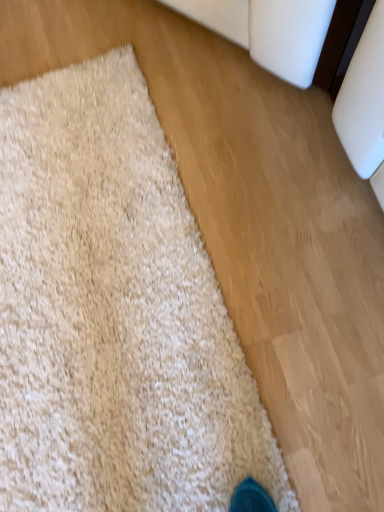
The image size is (384, 512). In order to click on white shaggy rug at lower left in this screenshot , I will do `click(114, 314)`.

What do you see at coordinates (114, 314) in the screenshot? I see `white shaggy rug at lower left` at bounding box center [114, 314].

Identify the location of white shaggy rug at lower left. (114, 314).